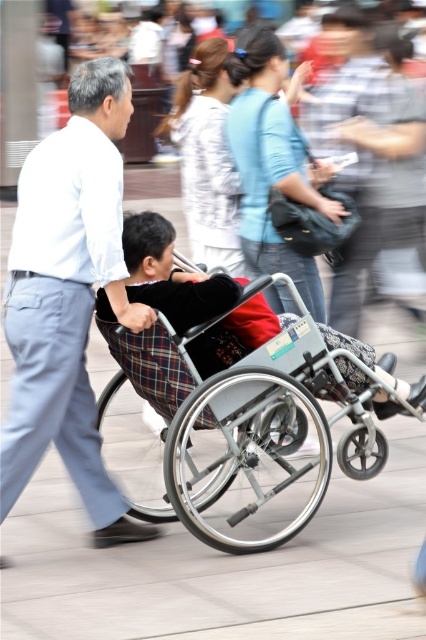
Can you confirm if light blue cotton shirt at left is positioned to the right of metallic gray wheelchair at center?

No, light blue cotton shirt at left is not to the right of metallic gray wheelchair at center.

Is point (69, 413) less distant than point (245, 416)?

No, it is behind (245, 416).

Is point (14, 307) closer to camera compared to point (235, 524)?

Yes, it is.

Identify the location of light blue cotton shirt at left. (69, 296).